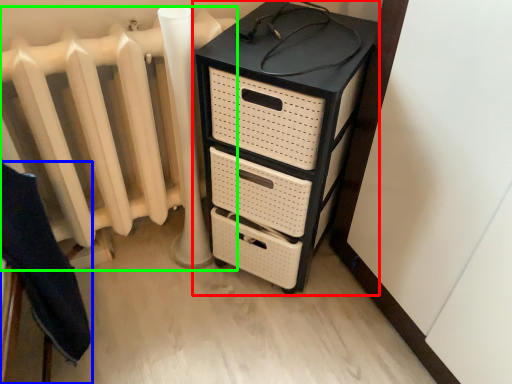
Question: Based on their relative distances, which object is nearer to chest of drawers (highlighted by a red box)? Choose from furniture (highlighted by a blue box) and radiator (highlighted by a green box).

Choices:
 (A) furniture
 (B) radiator

Answer: (B)